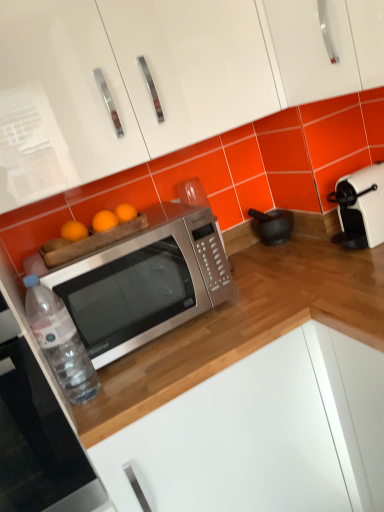
Locate an element on the screen. Image resolution: width=384 pixels, height=512 pixels. vacant area that is in front of satin silver microwave at center is located at coordinates (160, 360).